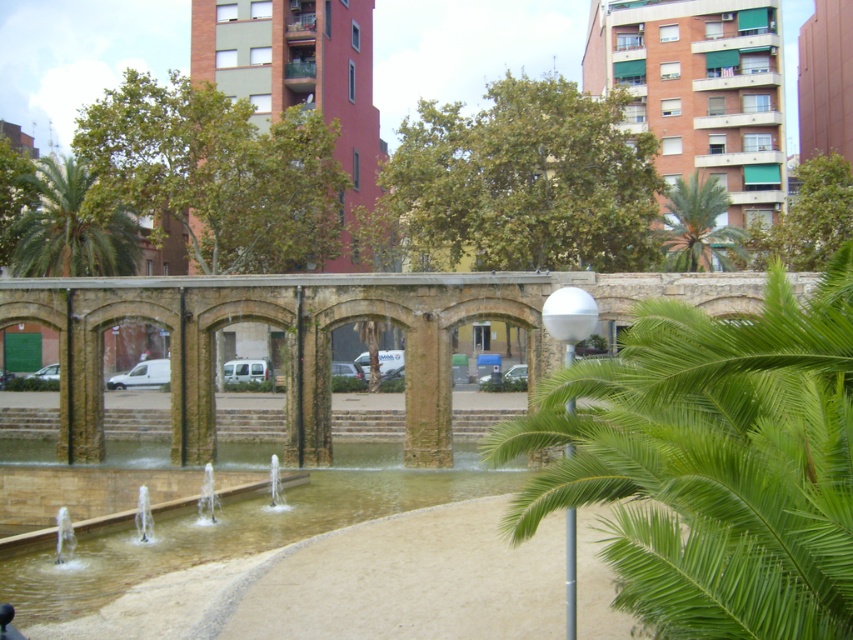
Question: Is green leafy palm tree at center to the left of green leafy palm tree at left from the viewer's perspective?

Choices:
 (A) no
 (B) yes

Answer: (A)

Question: Which point is closer to the camera?

Choices:
 (A) green leafy palm tree at left
 (B) green leafy palm tree at upper right
 (C) clear water at center
 (D) green leafy palm tree at center

Answer: (D)

Question: Does green leafy palm tree at center appear on the left side of green leafy palm tree at upper right?

Choices:
 (A) yes
 (B) no

Answer: (A)

Question: Which object appears farthest from the camera in this image?

Choices:
 (A) clear water at center
 (B) green leafy palm tree at center

Answer: (A)

Question: Is green leafy palm tree at center thinner than green leafy palm tree at left?

Choices:
 (A) yes
 (B) no

Answer: (A)

Question: Which of the following is the farthest from the observer?

Choices:
 (A) clear water at center
 (B) green leafy palm tree at upper right

Answer: (B)